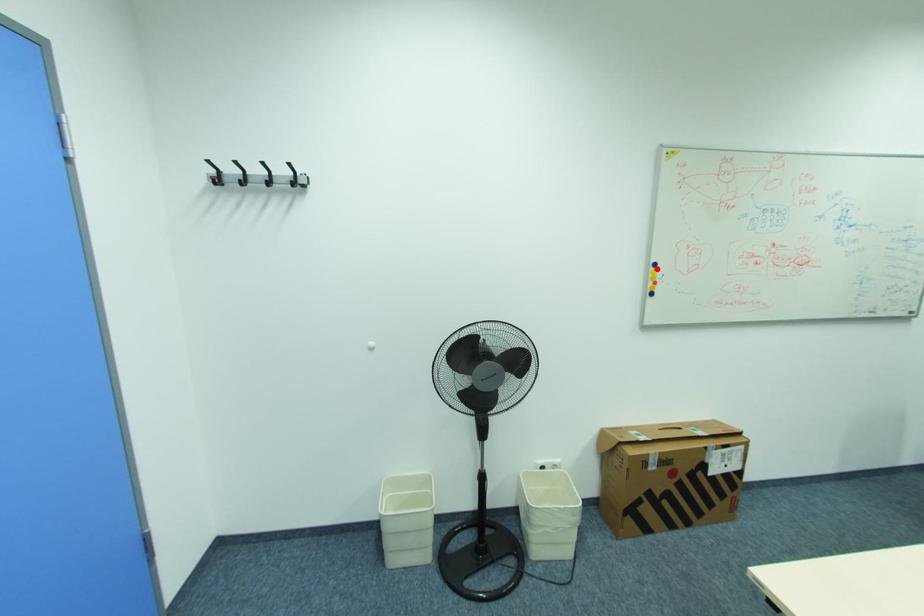
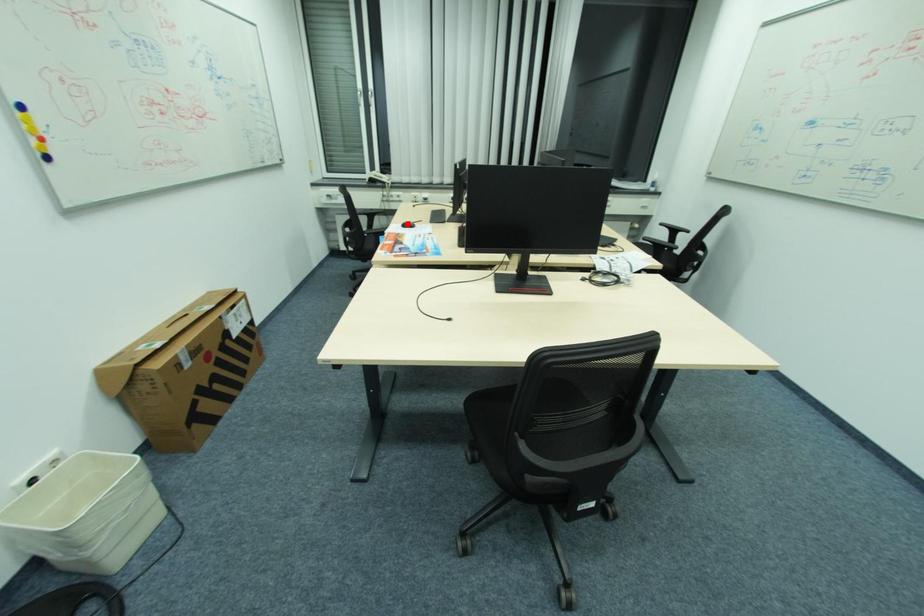
I am providing you with two images of the same scene from different viewpoints. A red point is marked on the first image and another point is marked on the second image. Does the point marked in image1 correspond to the same location as the one in image2?

No